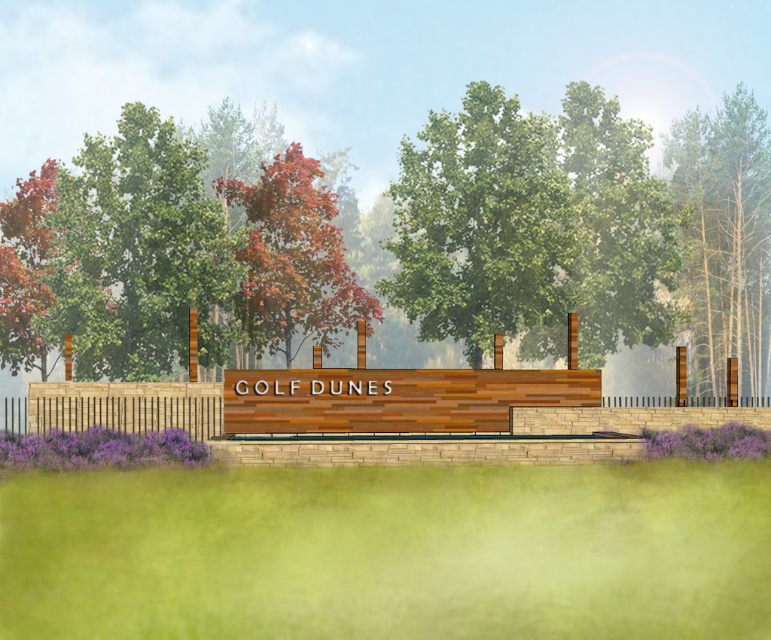
Which is more to the left, green leafy tree at center or brown wooden fence at lower left?

Positioned to the left is brown wooden fence at lower left.

Which is more to the right, green leafy tree at center or brown wooden fence at lower left?

green leafy tree at center is more to the right.

Is point (408, 141) behind point (170, 394)?

Yes, point (408, 141) is farther from viewer.

Where is `green leafy tree at center`? The image size is (771, 640). green leafy tree at center is located at coordinates (480, 225).

Who is more forward, [184,333] or [756,308]?

Point [184,333] is more forward.

The height and width of the screenshot is (640, 771). What do you see at coordinates (140, 252) in the screenshot? I see `green leafy tree at upper left` at bounding box center [140, 252].

Identify the location of green leafy tree at upper left. The height and width of the screenshot is (640, 771). (140, 252).

Does green leafy tree at center lie behind green leafy tree at upper left?

That is False.

Does green leafy tree at center have a lesser width compared to green leafy tree at upper left?

Correct, green leafy tree at center's width is less than green leafy tree at upper left's.

I want to click on green leafy tree at center, so click(480, 225).